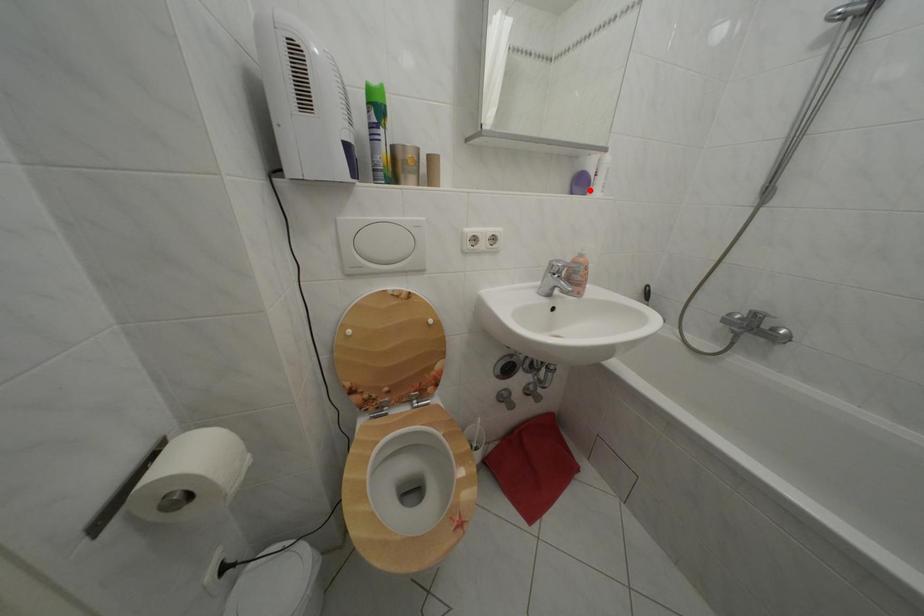
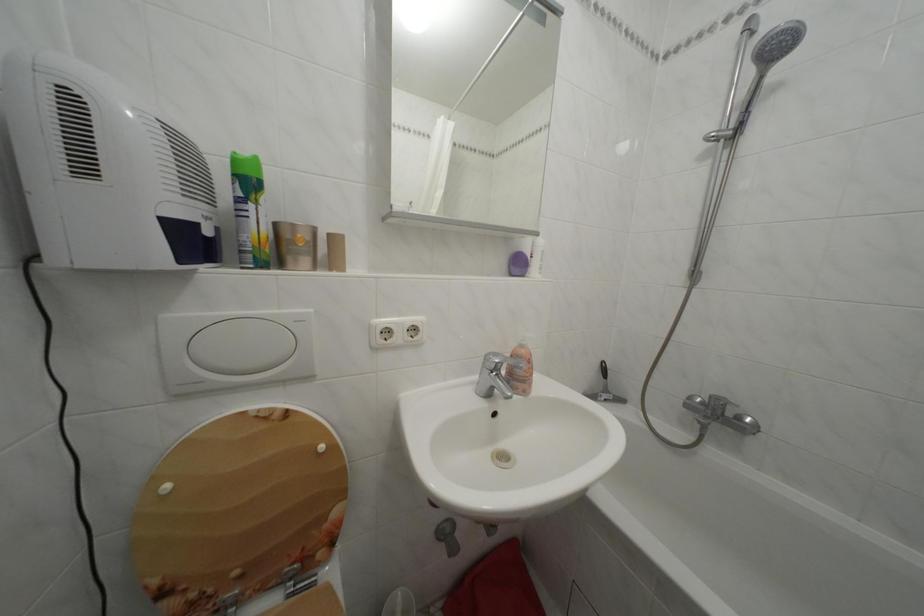
Where in the second image is the point corresponding to the highlighted location from the first image?

(527, 270)